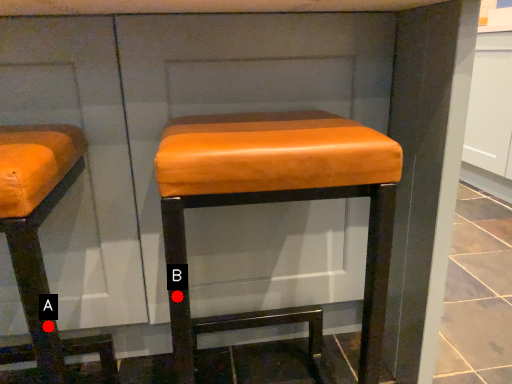
Question: Two points are circled on the image, labeled by A and B beside each circle. Among these points, which one is nearest to the camera?

Choices:
 (A) A is closer
 (B) B is closer

Answer: (B)